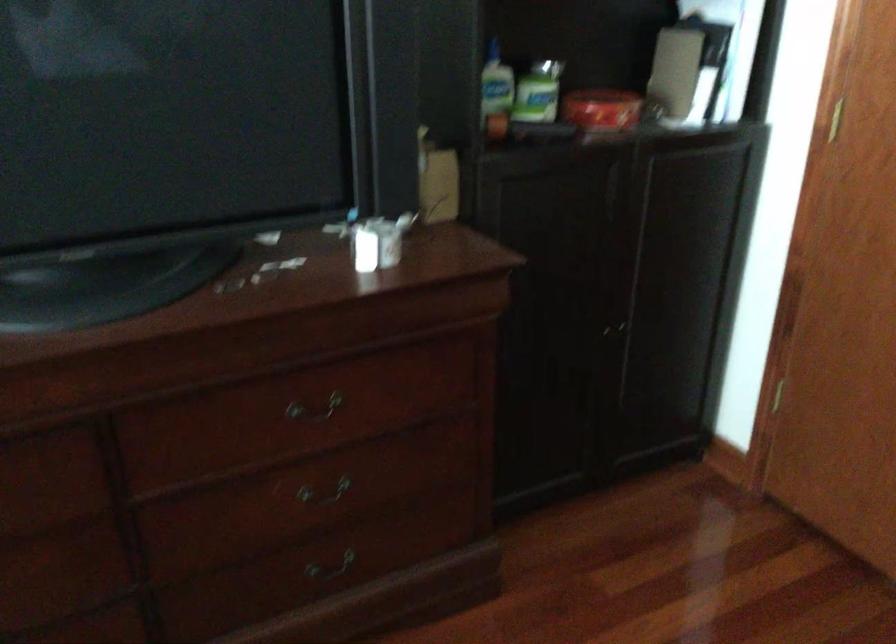
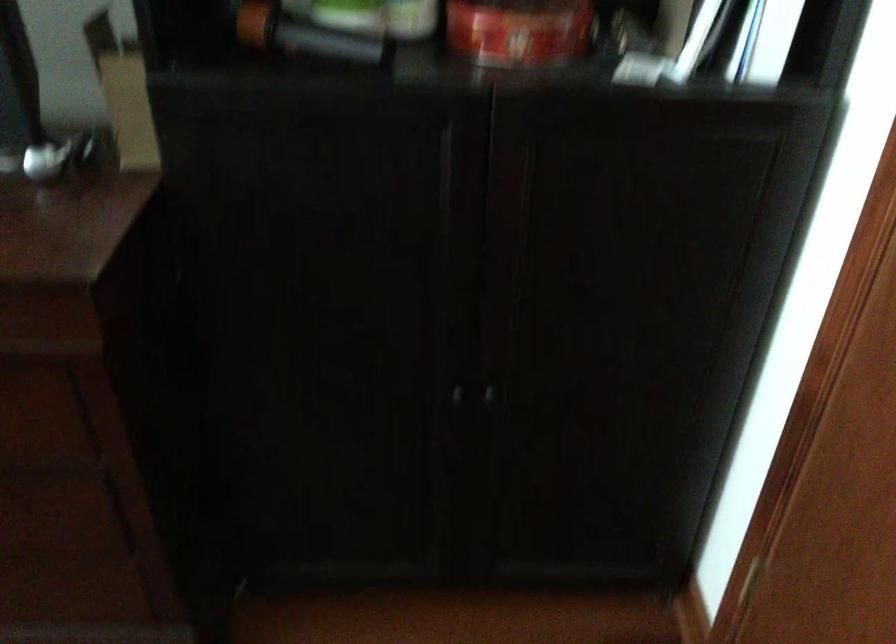
Locate, in the second image, the point that corresponds to pixel 521 129 in the first image.

(304, 35)